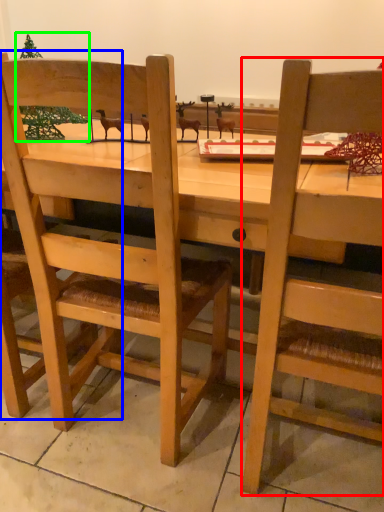
Question: Based on their relative distances, which object is farther from chair (highlighted by a red box)? Choose from chair (highlighted by a blue box) and christmas tree (highlighted by a green box).

Choices:
 (A) chair
 (B) christmas tree

Answer: (B)